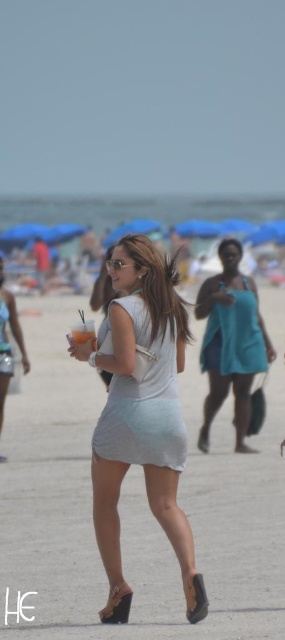
What is the color of the dress worn by the person at the coordinates point (x=231, y=340)?

The point (x=231, y=340) corresponds to the teal fabric dress at center, so the dress is teal in color.